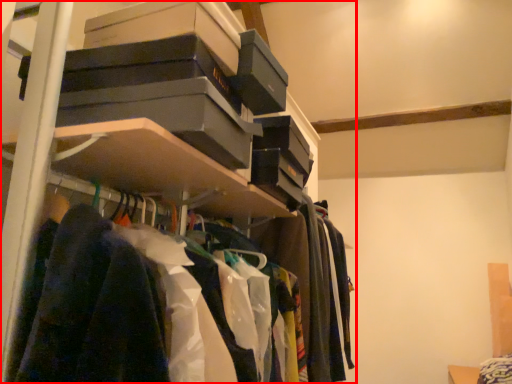
Question: From the image's perspective, what is the correct spatial positioning of shelf (annotated by the red box) in reference to clothing?

Choices:
 (A) below
 (B) above

Answer: (A)